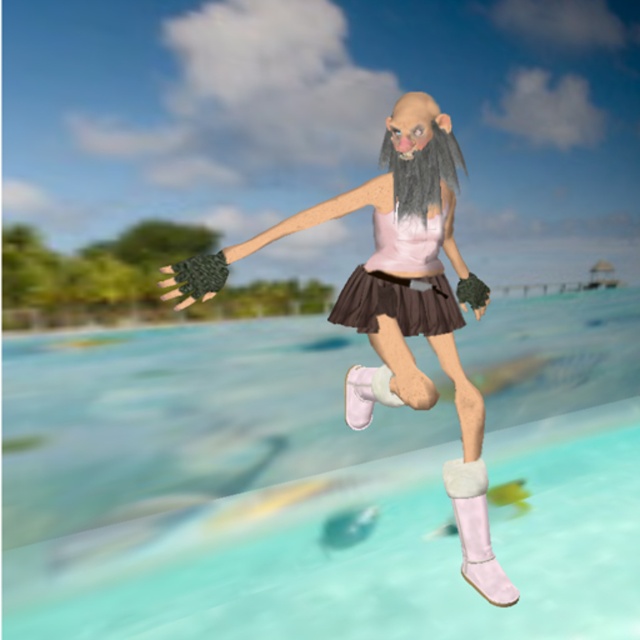
Based on the scene described, where is the clear blue water at center located relative to the matte pink tank top at center?

The clear blue water at center is to the right of the matte pink tank top at center.

Based on the scene, if the character wearing the matte pink tank top at center wants to touch the clear blue water at center, would they need to move downward?

Yes, the character would need to move downward because the clear blue water at center is located below the matte pink tank top at center.

You are designing a poster and need to ensure the pink matte dress at center is visible against the clear blue water at center. Given their sizes, which object might require adjustment in the design to maintain visibility?

The pink matte dress at center might need to be enlarged or the clear blue water at center narrowed since the clear blue water at center is wider than the pink matte dress at center, potentially making the dress appear smaller and less noticeable.